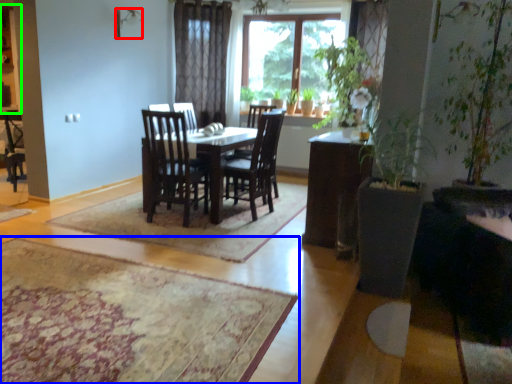
Question: Based on their relative distances, which object is nearer to lamp (highlighted by a red box)? Choose from mat (highlighted by a blue box) and cabinetry (highlighted by a green box).

Choices:
 (A) mat
 (B) cabinetry

Answer: (B)